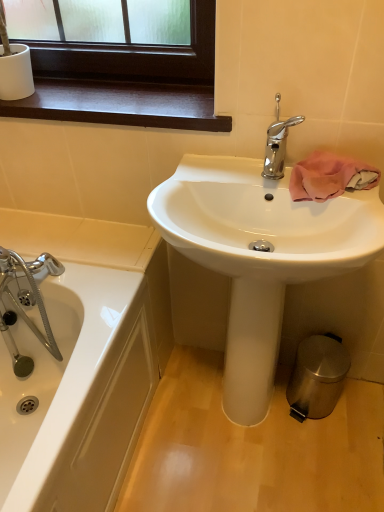
Question: Looking at the image, does polished stainless steel trash can at lower right seem bigger or smaller compared to polished chrome faucet at upper center?

Choices:
 (A) small
 (B) big

Answer: (B)

Question: In terms of height, does polished stainless steel trash can at lower right look taller or shorter compared to polished chrome faucet at upper center?

Choices:
 (A) short
 (B) tall

Answer: (B)

Question: Based on their relative distances, which object is farther from the pink fabric towel at upper right?

Choices:
 (A) polished chrome faucet at upper center
 (B) metallic silver trash can at lower right
 (C) polished stainless steel trash can at lower right
 (D) dark wood window sill at upper left
 (E) white glossy sink at center

Answer: (B)

Question: Which object is the farthest from the metallic silver trash can at lower right?

Choices:
 (A) polished chrome faucet at upper center
 (B) pink fabric towel at upper right
 (C) polished stainless steel trash can at lower right
 (D) white glossy sink at center
 (E) dark wood window sill at upper left

Answer: (E)